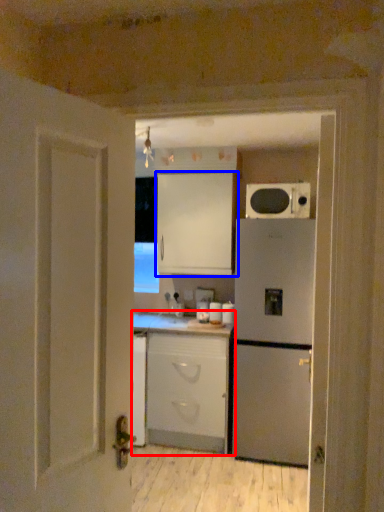
Question: Which object is closer to the camera taking this photo, cabinetry (highlighted by a red box) or cabinetry (highlighted by a blue box)?

Choices:
 (A) cabinetry
 (B) cabinetry

Answer: (A)